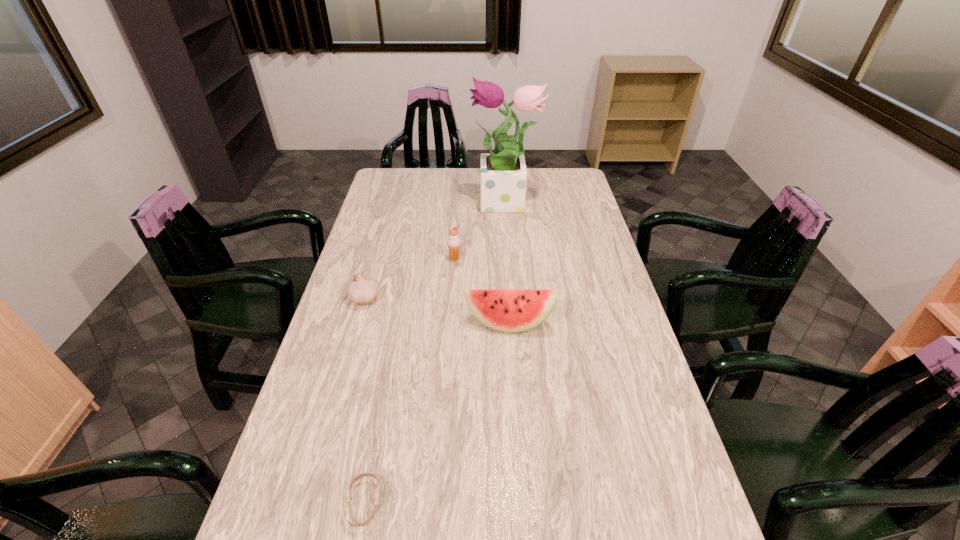
Identify the location of free location located on the front-facing side of the flower arrangement. This screenshot has height=540, width=960. (384, 204).

Find the location of a particular element. free point located on the front-facing side of the flower arrangement is located at coordinates (389, 204).

The height and width of the screenshot is (540, 960). I want to click on free space located 0.070m on the outer rind of the fourth farthest object, so click(x=511, y=355).

You are a GUI agent. You are given a task and a screenshot of the screen. Output one action in this format:
    pyautogui.click(x=<x>, y=<y>)
    Task: Click on the vacant space located at the front with a straw on the third object from right to left
    The height and width of the screenshot is (540, 960).
    Given the screenshot: What is the action you would take?
    pyautogui.click(x=451, y=304)

Locate an element on the screen. The image size is (960, 540). vacant space positioned on the right of the third nearest object is located at coordinates (477, 298).

You are a GUI agent. You are given a task and a screenshot of the screen. Output one action in this format:
    pyautogui.click(x=<x>, y=<y>)
    Task: Click on the vacant region located 0.130m on the face of the shortest object
    Image resolution: width=960 pixels, height=540 pixels.
    Given the screenshot: What is the action you would take?
    pyautogui.click(x=443, y=503)

Find the location of a particular element. This screenshot has width=960, height=540. object positioned at the far edge is located at coordinates (503, 171).

Locate an element on the screen. The width and height of the screenshot is (960, 540). object positioned at the left edge is located at coordinates (361, 290).

Identify the location of free space at the far edge of the desktop. This screenshot has width=960, height=540. (433, 184).

What are the coordinates of `vacant space at the left edge of the desktop` in the screenshot? It's located at pos(373,248).